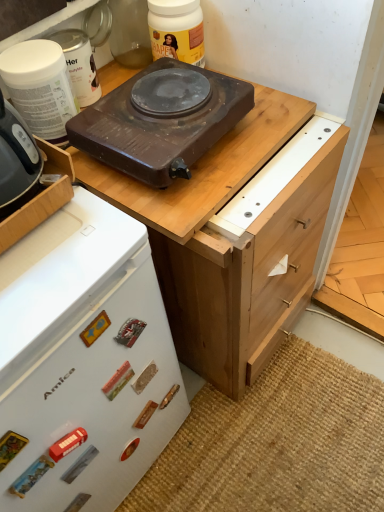
Measure the distance between matte black hot plate at upper center, the first kitchen appliance in the right-to-left sequence, and camera.

A distance of 90.31 centimeters exists between matte black hot plate at upper center, the first kitchen appliance in the right-to-left sequence, and camera.

What is the approximate height of brown matte electric stove at upper center, positioned as the second kitchen appliance in right-to-left order?

It is 9.87 centimeters.

This screenshot has width=384, height=512. I want to click on matte black hot plate at upper center, the first kitchen appliance in the right-to-left sequence, so click(x=177, y=30).

This screenshot has height=512, width=384. In order to click on the chest of drawers that is below the white plastic container at upper left, arranged as the third kitchen appliance when viewed from the right (from the image's perspective) in this screenshot , I will do `click(231, 241)`.

Is white plastic container at upper left, which ranks as the 2th kitchen appliance in left-to-right order, not near brown wooden chest of drawers at upper center?

They are positioned close to each other.

From the image's perspective, is white plastic container at upper left, which ranks as the 2th kitchen appliance in left-to-right order, over brown wooden chest of drawers at upper center?

Indeed, from the image's perspective, white plastic container at upper left, which ranks as the 2th kitchen appliance in left-to-right order, is shown above brown wooden chest of drawers at upper center.

From a real-world perspective, does white plastic container at upper left, arranged as the third kitchen appliance when viewed from the right, stand above brown wooden chest of drawers at upper center?

Correct, in the physical world, white plastic container at upper left, arranged as the third kitchen appliance when viewed from the right, is higher than brown wooden chest of drawers at upper center.

From a real-world perspective, which object rests below the other?

matte black hot plate at upper center, the first kitchen appliance in the right-to-left sequence, from a real-world perspective.

How many degrees apart are the facing directions of matte black hot plate at upper center, positioned as the fourth kitchen appliance in left-to-right order, and white plastic container at upper left, the 4th kitchen appliance from the right?

0.211 degrees.

Between matte black hot plate at upper center, positioned as the fourth kitchen appliance in left-to-right order, and white plastic container at upper left, which ranks as the first kitchen appliance in left-to-right order, which one has smaller width?

matte black hot plate at upper center, positioned as the fourth kitchen appliance in left-to-right order.

Is matte black hot plate at upper center, the first kitchen appliance in the right-to-left sequence, turned away from white plastic container at upper left, which ranks as the first kitchen appliance in left-to-right order?

No, matte black hot plate at upper center, the first kitchen appliance in the right-to-left sequence, is not facing the opposite direction of white plastic container at upper left, which ranks as the first kitchen appliance in left-to-right order.

Can you tell me how much matte black hot plate at upper center, positioned as the fourth kitchen appliance in left-to-right order, and brown matte electric stove at upper center differ in facing direction?

The angular difference between matte black hot plate at upper center, positioned as the fourth kitchen appliance in left-to-right order, and brown matte electric stove at upper center is 0.573 degrees.

Does matte black hot plate at upper center, positioned as the fourth kitchen appliance in left-to-right order, have a smaller size compared to brown matte electric stove at upper center?

Indeed, matte black hot plate at upper center, positioned as the fourth kitchen appliance in left-to-right order, has a smaller size compared to brown matte electric stove at upper center.

Based on the photo, considering the positions of objects matte black hot plate at upper center, positioned as the fourth kitchen appliance in left-to-right order, and brown matte electric stove at upper center in the image provided, who is more to the left, matte black hot plate at upper center, positioned as the fourth kitchen appliance in left-to-right order, or brown matte electric stove at upper center?

Positioned to the left is brown matte electric stove at upper center.

Relative to brown matte electric stove at upper center, is matte black hot plate at upper center, the first kitchen appliance in the right-to-left sequence, in front or behind?

Visually, matte black hot plate at upper center, the first kitchen appliance in the right-to-left sequence, is located behind brown matte electric stove at upper center.

How different are the orientations of white plastic container at upper left, which ranks as the first kitchen appliance in left-to-right order, and brown matte electric stove at upper center, positioned as the second kitchen appliance in right-to-left order, in degrees?

white plastic container at upper left, which ranks as the first kitchen appliance in left-to-right order, and brown matte electric stove at upper center, positioned as the second kitchen appliance in right-to-left order, are facing 0.912 degrees away from each other.

From the image's perspective, who appears lower, white plastic container at upper left, the 4th kitchen appliance from the right, or brown matte electric stove at upper center, the 3th kitchen appliance viewed from the left?

brown matte electric stove at upper center, the 3th kitchen appliance viewed from the left.

Is brown matte electric stove at upper center, positioned as the second kitchen appliance in right-to-left order, completely or partially inside white plastic container at upper left, which ranks as the first kitchen appliance in left-to-right order?

No.

In the scene shown: Considering the positions of objects white plastic container at upper left, the 4th kitchen appliance from the right, and brown matte electric stove at upper center, the 3th kitchen appliance viewed from the left, in the image provided, who is more to the left, white plastic container at upper left, the 4th kitchen appliance from the right, or brown matte electric stove at upper center, the 3th kitchen appliance viewed from the left,?

Positioned to the left is white plastic container at upper left, the 4th kitchen appliance from the right.

Is brown matte electric stove at upper center, the 3th kitchen appliance viewed from the left, not inside white plastic container at upper left, which ranks as the 2th kitchen appliance in left-to-right order?

Indeed, brown matte electric stove at upper center, the 3th kitchen appliance viewed from the left, is completely outside white plastic container at upper left, which ranks as the 2th kitchen appliance in left-to-right order.

Is point (114, 90) positioned after point (73, 67)?

No.

Is brown matte electric stove at upper center, positioned as the second kitchen appliance in right-to-left order, in contact with white plastic container at upper left, which ranks as the 2th kitchen appliance in left-to-right order?

There is a gap between brown matte electric stove at upper center, positioned as the second kitchen appliance in right-to-left order, and white plastic container at upper left, which ranks as the 2th kitchen appliance in left-to-right order.

Which of these two, brown matte electric stove at upper center, the 3th kitchen appliance viewed from the left, or white plastic container at upper left, which ranks as the 2th kitchen appliance in left-to-right order, stands shorter?

With less height is brown matte electric stove at upper center, the 3th kitchen appliance viewed from the left.

The height and width of the screenshot is (512, 384). What are the coordinates of `kitchen appliance that is the 1st one when counting rightward from the brown matte electric stove at upper center` in the screenshot? It's located at (40, 87).

Considering the points (107, 307) and (53, 104), which point is in front, point (107, 307) or point (53, 104)?

The point (107, 307) is closer.

From a real-world perspective, is brown matte electric stove at upper center positioned over white plastic container at upper left, which ranks as the first kitchen appliance in left-to-right order, based on gravity?

No, from a real-world perspective, brown matte electric stove at upper center is not on top of white plastic container at upper left, which ranks as the first kitchen appliance in left-to-right order.

Does brown matte electric stove at upper center have a lesser height compared to white plastic container at upper left, the 4th kitchen appliance from the right?

No.

How much distance is there between white plastic container at upper left, which ranks as the 2th kitchen appliance in left-to-right order, and brown matte electric stove at upper center, the 3th kitchen appliance viewed from the left?

white plastic container at upper left, which ranks as the 2th kitchen appliance in left-to-right order, is 9.10 inches away from brown matte electric stove at upper center, the 3th kitchen appliance viewed from the left.

Between white plastic container at upper left, which ranks as the 2th kitchen appliance in left-to-right order, and brown matte electric stove at upper center, the 3th kitchen appliance viewed from the left, which one has less height?

Standing shorter between the two is brown matte electric stove at upper center, the 3th kitchen appliance viewed from the left.

How many degrees apart are the facing directions of white plastic container at upper left, arranged as the third kitchen appliance when viewed from the right, and brown matte electric stove at upper center, positioned as the second kitchen appliance in right-to-left order?

0.794 degrees separate the facing orientations of white plastic container at upper left, arranged as the third kitchen appliance when viewed from the right, and brown matte electric stove at upper center, positioned as the second kitchen appliance in right-to-left order.

The height and width of the screenshot is (512, 384). In order to click on kitchen appliance directly beneath the white plastic container at upper left, arranged as the third kitchen appliance when viewed from the right (from a real-world perspective) in this screenshot , I will do `click(148, 130)`.

From a real-world perspective, which kitchen appliance is the 2nd one above the brown wooden chest of drawers at upper center? Please provide its 2D coordinates.

[(79, 64)]

Identify the location of the 2nd kitchen appliance in front of the matte black hot plate at upper center, the first kitchen appliance in the right-to-left sequence. The image size is (384, 512). (40, 87).

When comparing their distances from brown matte electric stove at upper center, does brown wooden chest of drawers at upper center or white plastic container at upper left, arranged as the third kitchen appliance when viewed from the right, seem closer?

A: Among the two, brown wooden chest of drawers at upper center is located nearer to brown matte electric stove at upper center.

Which object lies nearer to the anchor point light brown wood drawer at right, white plastic container at upper left, which ranks as the 2th kitchen appliance in left-to-right order, or brown wooden chest of drawers at upper center?

brown wooden chest of drawers at upper center is positioned closer to the anchor light brown wood drawer at right.

Estimate the real-world distances between objects in this image. Which object is further from white plastic container at upper left, the 4th kitchen appliance from the right, matte black hot plate at upper center, the first kitchen appliance in the right-to-left sequence, or light brown wood drawer at right?

light brown wood drawer at right.

From the image, which object appears to be farther from matte black hot plate at upper center, the first kitchen appliance in the right-to-left sequence, brown wooden chest of drawers at upper center or white plastic container at upper left, the 4th kitchen appliance from the right?

Among the two, brown wooden chest of drawers at upper center is located further to matte black hot plate at upper center, the first kitchen appliance in the right-to-left sequence.

From the image, which object appears to be farther from brown matte electric stove at upper center, positioned as the second kitchen appliance in right-to-left order, brown wooden chest of drawers at upper center or white plastic container at upper left, which ranks as the first kitchen appliance in left-to-right order?

brown wooden chest of drawers at upper center is positioned further to the anchor brown matte electric stove at upper center, positioned as the second kitchen appliance in right-to-left order.

In the scene shown: When comparing their distances from brown matte electric stove at upper center, does brown matte electric stove at upper center, positioned as the second kitchen appliance in right-to-left order, or light brown wood drawer at right seem closer?

The object closer to brown matte electric stove at upper center is brown matte electric stove at upper center, positioned as the second kitchen appliance in right-to-left order.

Considering their positions, is white plastic container at upper left, which ranks as the 2th kitchen appliance in left-to-right order, positioned closer to white plastic container at upper left, the 4th kitchen appliance from the right, than brown matte electric stove at upper center?

Based on the image, white plastic container at upper left, which ranks as the 2th kitchen appliance in left-to-right order, appears to be nearer to white plastic container at upper left, the 4th kitchen appliance from the right.

From the image, which object appears to be farther from white plastic container at upper left, arranged as the third kitchen appliance when viewed from the right, brown wooden chest of drawers at upper center or brown matte electric stove at upper center, the 3th kitchen appliance viewed from the left?

The object further to white plastic container at upper left, arranged as the third kitchen appliance when viewed from the right, is brown wooden chest of drawers at upper center.

The image size is (384, 512). In order to click on chest of drawers between white plastic container at upper left, which ranks as the 2th kitchen appliance in left-to-right order, and light brown wood drawer at right, in the horizontal direction in this screenshot , I will do `click(231, 241)`.

In order to click on chest of drawers between matte black hot plate at upper center, positioned as the fourth kitchen appliance in left-to-right order, and brown matte electric stove at upper center from top to bottom in this screenshot , I will do `click(231, 241)`.

The image size is (384, 512). Identify the location of chest of drawers between white plastic container at upper left, which ranks as the first kitchen appliance in left-to-right order, and light brown wood drawer at right from left to right. (231, 241).

Locate an element on the screen. This screenshot has width=384, height=512. chest of drawers between brown matte electric stove at upper center and light brown wood drawer at right from left to right is located at coordinates (231, 241).